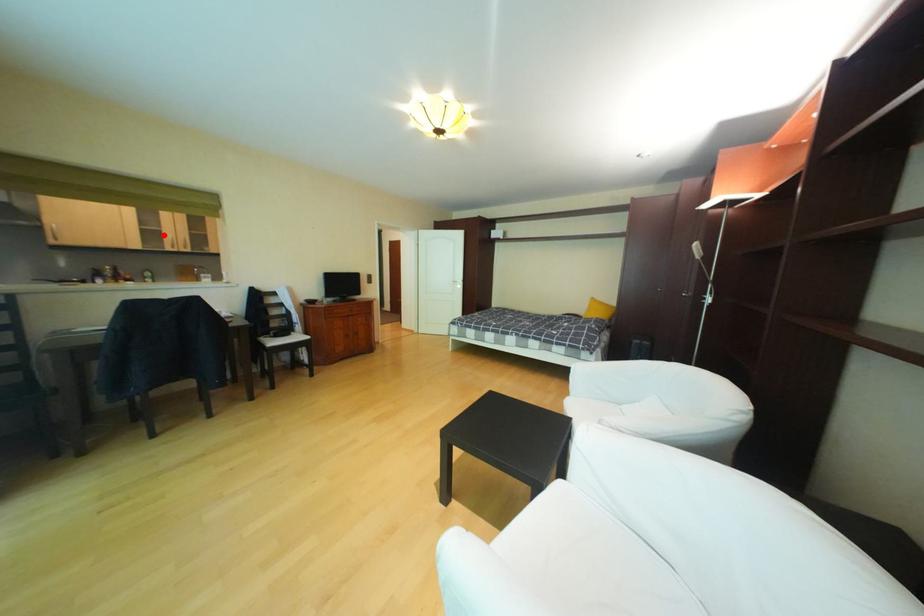
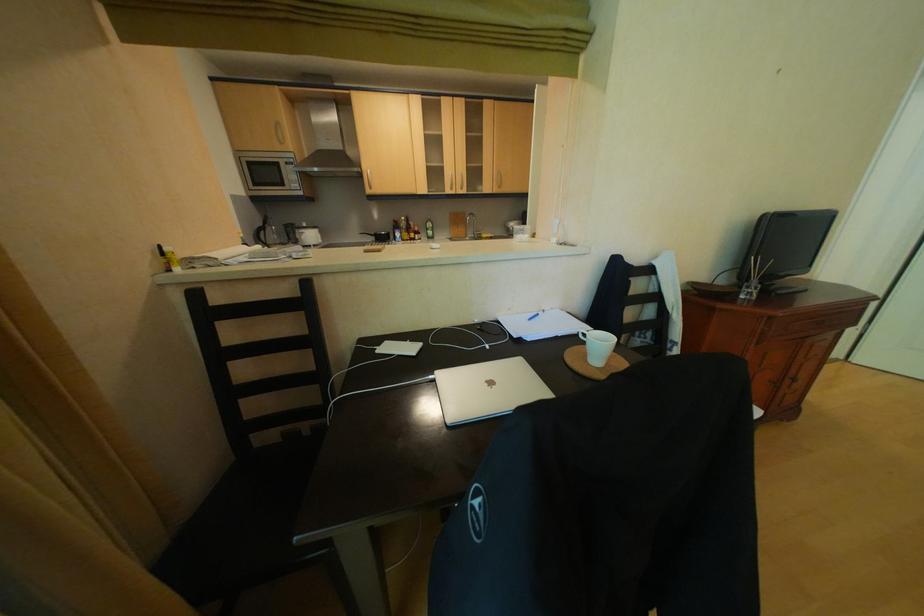
Question: I am providing you with two images of the same scene from different viewpoints. Given a red point in image1, look at the same physical point in image2. Is it:

Choices:
 (A) Closer to the viewpoint
 (B) Farther from the viewpoint

Answer: (A)